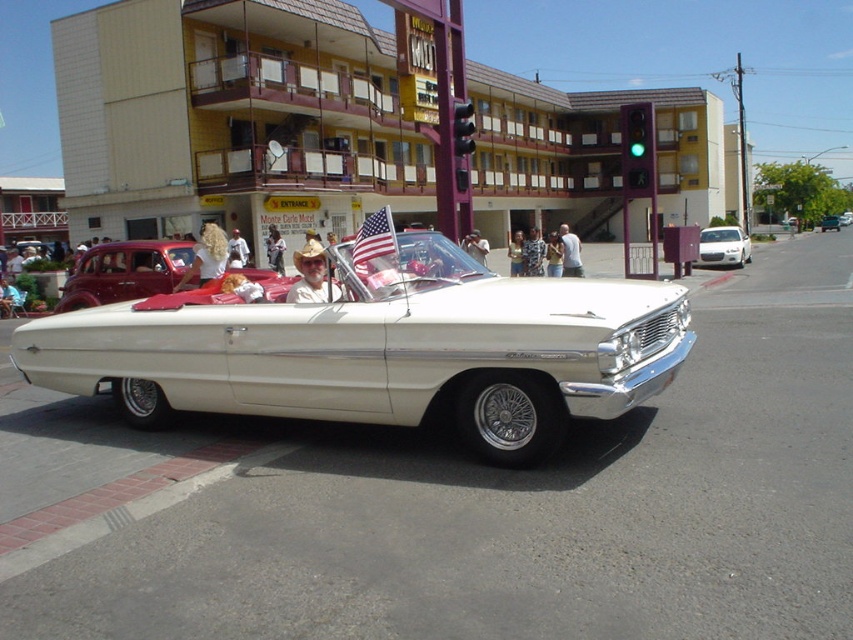
Question: Is white metallic sedan at center closer to camera compared to metallic silver convertible at center?

Choices:
 (A) yes
 (B) no

Answer: (A)

Question: Which point is closer to the camera taking this photo?

Choices:
 (A) (340, 362)
 (B) (94, 257)

Answer: (A)

Question: Is matte red convertible at center wider than american flag at center?

Choices:
 (A) no
 (B) yes

Answer: (B)

Question: Which of the following is the farthest from the observer?

Choices:
 (A) (123, 268)
 (B) (741, 248)
 (C) (538, 301)
 (D) (834, 228)

Answer: (D)

Question: Is white metallic convertible at center positioned before white metallic sedan at center?

Choices:
 (A) no
 (B) yes

Answer: (B)

Question: Which object appears farthest from the camera in this image?

Choices:
 (A) metallic silver convertible at center
 (B) american flag at center
 (C) white metallic sedan at center

Answer: (A)